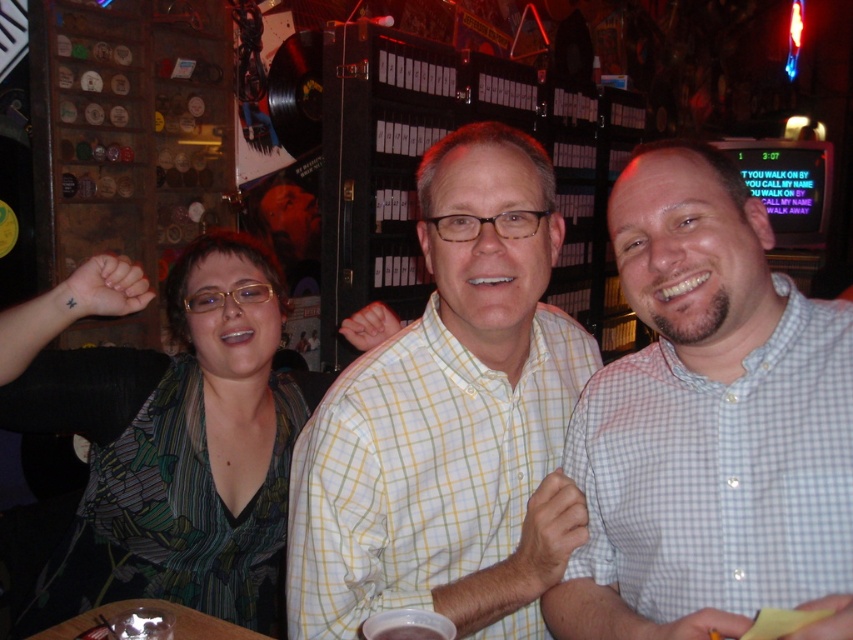
Question: Does white checkered shirt at center lie in front of yellow checkered shirt at center?

Choices:
 (A) yes
 (B) no

Answer: (A)

Question: Does yellow checkered shirt at center have a lesser width compared to green printed dress at center?

Choices:
 (A) no
 (B) yes

Answer: (B)

Question: Among these points, which one is nearest to the camera?

Choices:
 (A) (178, 534)
 (B) (303, 538)
 (C) (842, 401)

Answer: (C)

Question: Which object appears closest to the camera in this image?

Choices:
 (A) white checkered shirt at center
 (B) green printed dress at center

Answer: (A)

Question: Among these objects, which one is farthest from the camera?

Choices:
 (A) green printed dress at center
 (B) white checkered shirt at center

Answer: (A)

Question: Is the position of white checkered shirt at center less distant than that of green printed dress at center?

Choices:
 (A) no
 (B) yes

Answer: (B)